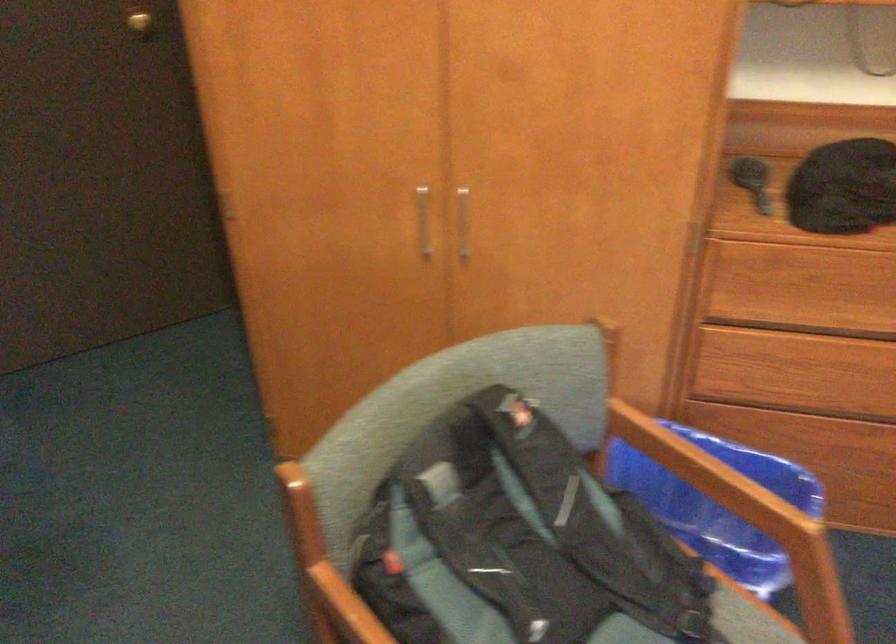
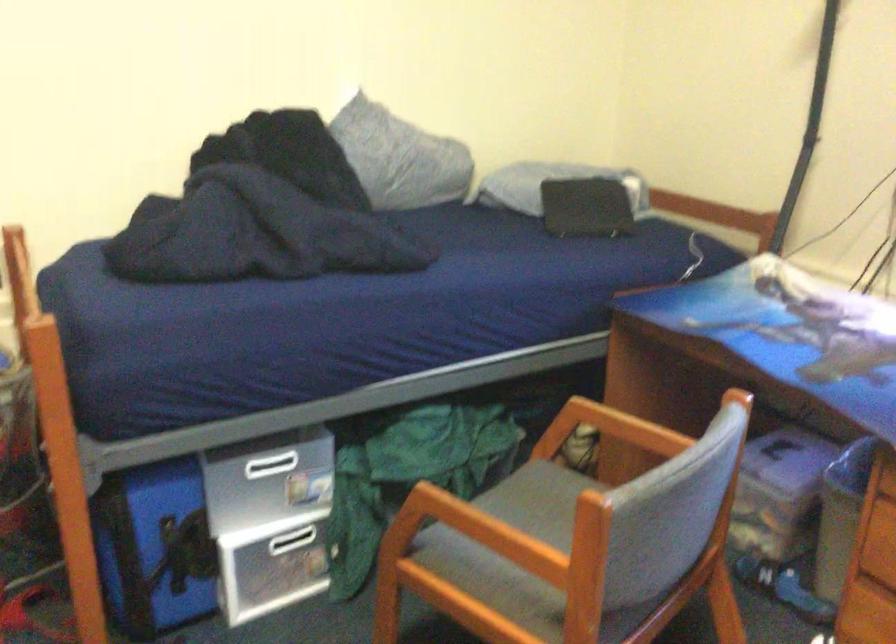
First-person continuous shooting, in which direction is the camera rotating?

The camera's rotation is toward right-down.